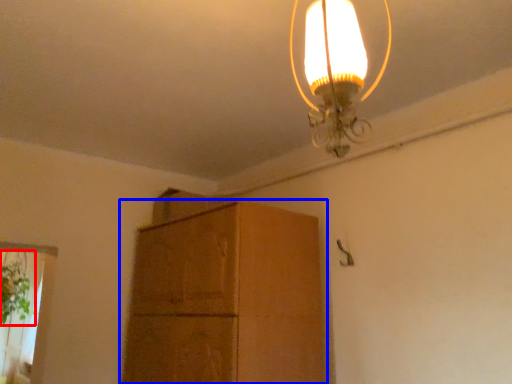
Question: Which object appears farthest to the camera in this image, plant (highlighted by a red box) or cabinetry (highlighted by a blue box)?

Choices:
 (A) plant
 (B) cabinetry

Answer: (A)